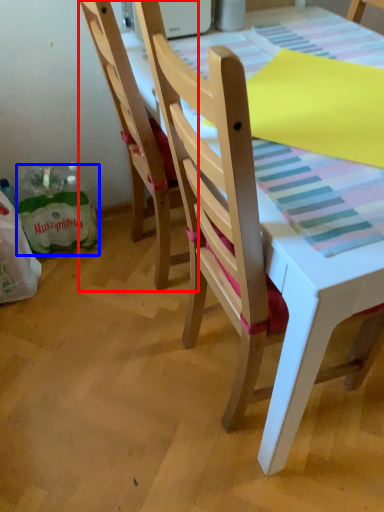
Question: Which object is closer to the camera taking this photo, chair (highlighted by a red box) or shopping bag (highlighted by a blue box)?

Choices:
 (A) chair
 (B) shopping bag

Answer: (A)